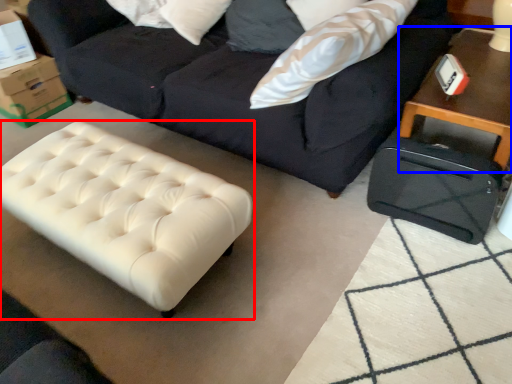
Question: Which object is closer to the camera taking this photo, table (highlighted by a red box) or table (highlighted by a blue box)?

Choices:
 (A) table
 (B) table

Answer: (A)